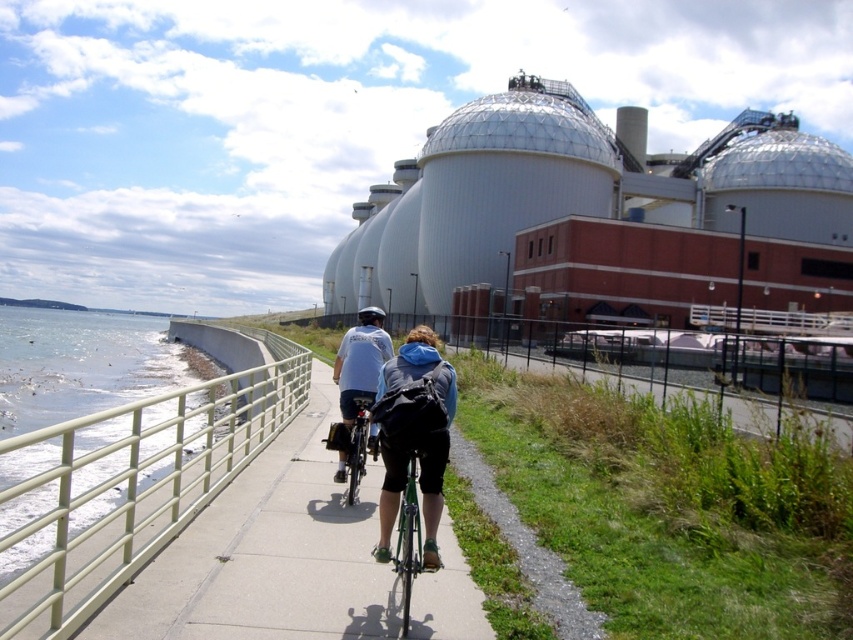
Between dark blue fabric jacket at center and green metallic bicycle at center, which one is positioned lower?

green metallic bicycle at center

How far apart are dark blue fabric jacket at center and green metallic bicycle at center?

dark blue fabric jacket at center is 9.89 inches from green metallic bicycle at center.

Who is more distant from viewer, (399, 465) or (409, 456)?

Point (399, 465)

Locate an element on the screen. dark blue fabric jacket at center is located at coordinates (413, 433).

Who is positioned more to the left, green matte railing at lower left or dark blue fabric jacket at center?

green matte railing at lower left

Which is in front, point (10, 525) or point (432, 556)?

Positioned in front is point (432, 556).

Does point (129, 428) lie behind point (428, 515)?

Yes, point (129, 428) is farther from viewer.

Locate an element on the screen. green matte railing at lower left is located at coordinates (125, 488).

Who is taller, dark blue fabric jacket at center or green matte bicycle at center?

dark blue fabric jacket at center is taller.

At what (x,y) coordinates should I click in order to perform the action: click on dark blue fabric jacket at center. Please return your answer as a coordinate pair (x, y). The image size is (853, 640). Looking at the image, I should click on (413, 433).